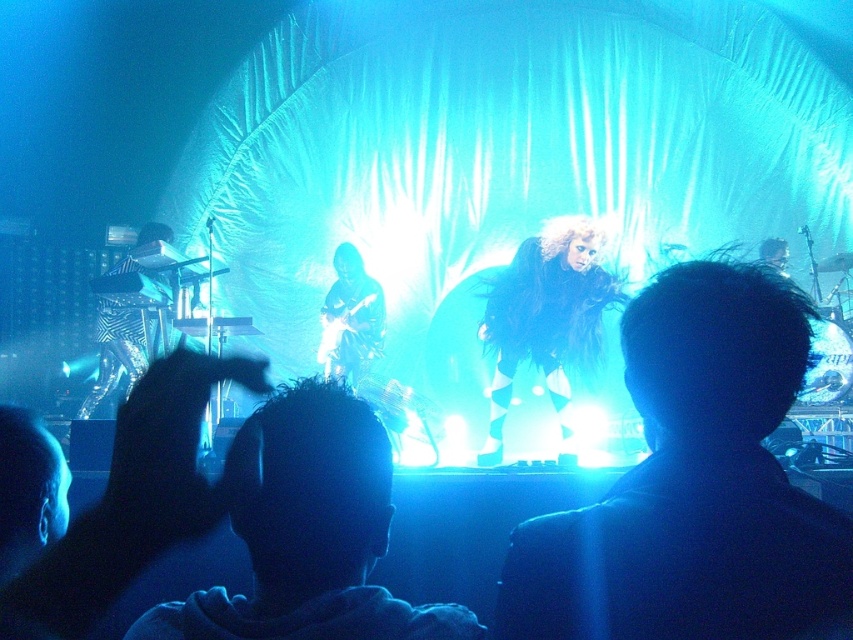
Who is more distant from viewer, (526, 273) or (318, 358)?

The point (318, 358) is behind.

Does fuzzy black wig at center have a lesser height compared to shiny black guitar at center?

No, fuzzy black wig at center is not shorter than shiny black guitar at center.

This screenshot has width=853, height=640. Describe the element at coordinates (546, 321) in the screenshot. I see `fuzzy black wig at center` at that location.

You are a GUI agent. You are given a task and a screenshot of the screen. Output one action in this format:
    pyautogui.click(x=<x>, y=<y>)
    Task: Click on the fuzzy black wig at center
    
    Given the screenshot: What is the action you would take?
    pyautogui.click(x=546, y=321)

Does fuzzy fur coat at center have a larger size compared to fuzzy black wig at center?

No, fuzzy fur coat at center is not bigger than fuzzy black wig at center.

What do you see at coordinates (693, 484) in the screenshot? I see `fuzzy fur coat at center` at bounding box center [693, 484].

Is point (614, 576) closer to camera compared to point (485, 342)?

Yes, it is in front of point (485, 342).

You are a GUI agent. You are given a task and a screenshot of the screen. Output one action in this format:
    pyautogui.click(x=<x>, y=<y>)
    Task: Click on the fuzzy fur coat at center
    
    Given the screenshot: What is the action you would take?
    pyautogui.click(x=693, y=484)

Is fuzzy fur coat at center bigger than dark hair at center?

No, fuzzy fur coat at center is not bigger than dark hair at center.

Is fuzzy fur coat at center taller than dark hair at center?

Correct, fuzzy fur coat at center is much taller as dark hair at center.

Find the location of a particular element. fuzzy fur coat at center is located at coordinates click(693, 484).

Find the location of a particular element. fuzzy fur coat at center is located at coordinates (693, 484).